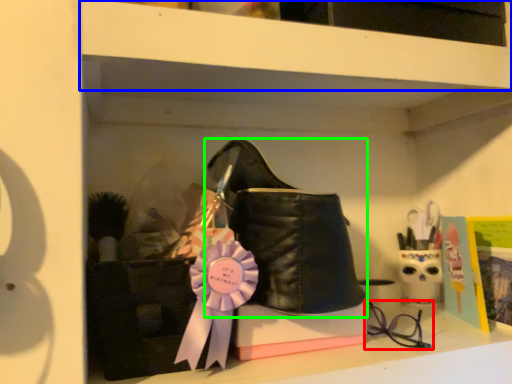
Question: Considering the real-world distances, which object is farthest from glasses (highlighted by a red box)? shelf (highlighted by a blue box) or footwear (highlighted by a green box)?

Choices:
 (A) shelf
 (B) footwear

Answer: (A)